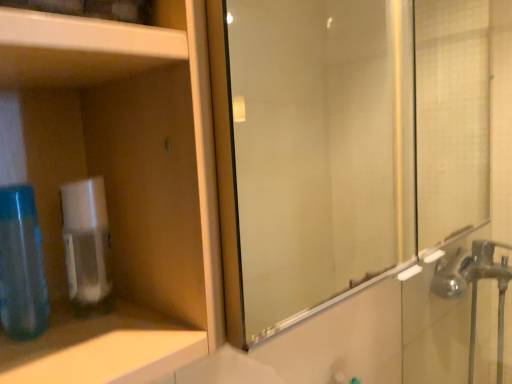
Question: From the image's perspective, is white glossy cabinet at upper left on silver metallic faucet at right?

Choices:
 (A) no
 (B) yes

Answer: (B)

Question: Is white glossy cabinet at upper left wider than silver metallic faucet at right?

Choices:
 (A) yes
 (B) no

Answer: (A)

Question: Would you consider white glossy cabinet at upper left to be distant from silver metallic faucet at right?

Choices:
 (A) no
 (B) yes

Answer: (B)

Question: From a real-world perspective, is white glossy cabinet at upper left physically below silver metallic faucet at right?

Choices:
 (A) no
 (B) yes

Answer: (A)

Question: Is the position of white glossy cabinet at upper left more distant than that of silver metallic faucet at right?

Choices:
 (A) no
 (B) yes

Answer: (A)

Question: Is white glossy cabinet at upper left completely or partially outside of silver metallic faucet at right?

Choices:
 (A) no
 (B) yes

Answer: (B)

Question: Is blue translucent bottle at left at the right side of white glossy cabinet at upper left?

Choices:
 (A) no
 (B) yes

Answer: (A)

Question: Is blue translucent bottle at left located outside white glossy cabinet at upper left?

Choices:
 (A) no
 (B) yes

Answer: (B)

Question: Is the depth of blue translucent bottle at left greater than that of white glossy cabinet at upper left?

Choices:
 (A) no
 (B) yes

Answer: (B)

Question: Is blue translucent bottle at left oriented away from white glossy cabinet at upper left?

Choices:
 (A) no
 (B) yes

Answer: (A)

Question: From a real-world perspective, is blue translucent bottle at left located beneath white glossy cabinet at upper left?

Choices:
 (A) no
 (B) yes

Answer: (B)

Question: Is blue translucent bottle at left shorter than white glossy cabinet at upper left?

Choices:
 (A) yes
 (B) no

Answer: (A)

Question: Are white glossy cabinet at upper left and clear plastic soap dispenser at left beside each other?

Choices:
 (A) yes
 (B) no

Answer: (B)